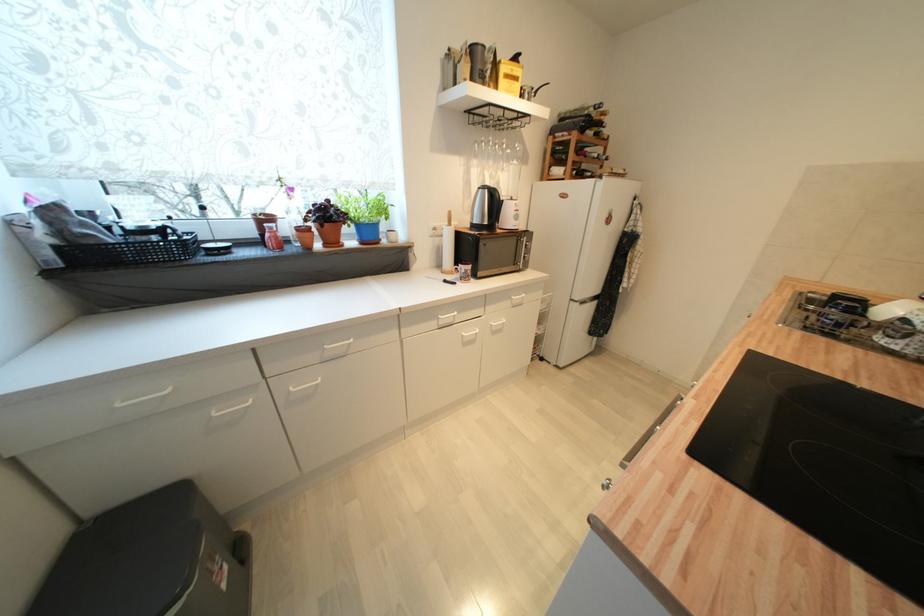
The image size is (924, 616). I want to click on trash can pedal, so click(137, 578).